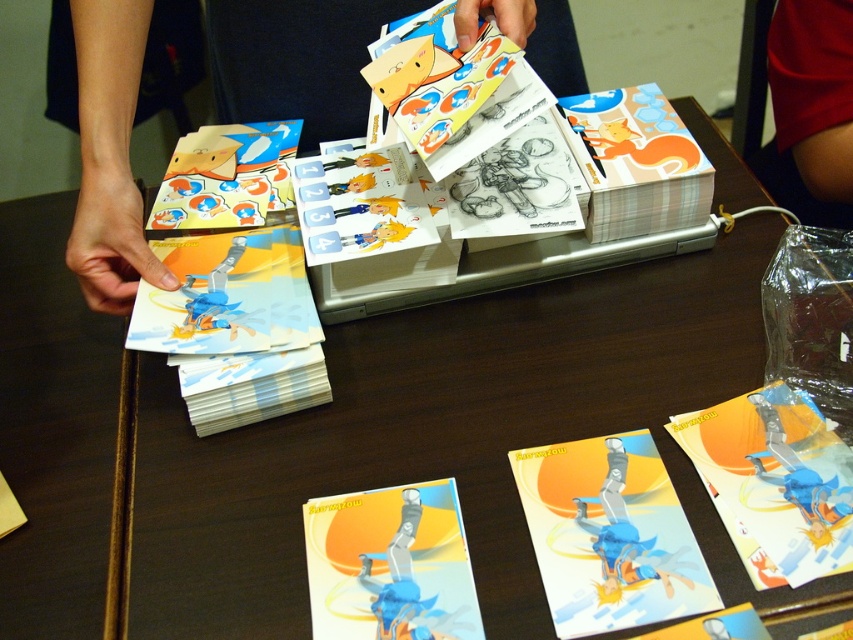
Question: In this image, where is matte paper card at center located relative to matte plastic cards at left?

Choices:
 (A) below
 (B) above

Answer: (A)

Question: Estimate the real-world distances between objects in this image. Which object is farther from the matte plastic cards at left?

Choices:
 (A) matte plastic card at center
 (B) matte paper card at center
 (C) matte paper cards at center
 (D) red fabric shorts at lower right

Answer: (D)

Question: Can you confirm if matte paper cards at center is smaller than matte plastic card at center?

Choices:
 (A) no
 (B) yes

Answer: (A)

Question: Can you confirm if matte paper card at center is positioned to the right of matte plastic card at center?

Choices:
 (A) yes
 (B) no

Answer: (A)

Question: Which of the following is the farthest from the observer?

Choices:
 (A) (619, 465)
 (B) (115, 260)

Answer: (B)

Question: Estimate the real-world distances between objects in this image. Which object is closer to the matte plastic cards at left?

Choices:
 (A) matte paper cards at center
 (B) matte paper card at center
 (C) matte plastic card at center

Answer: (A)